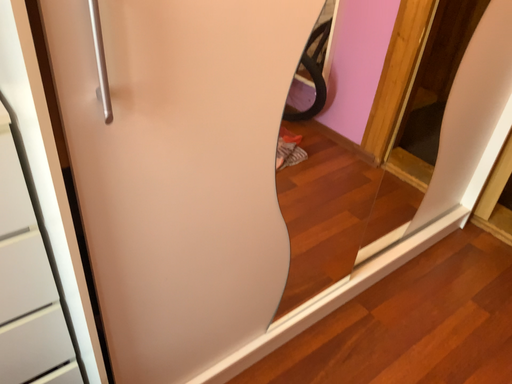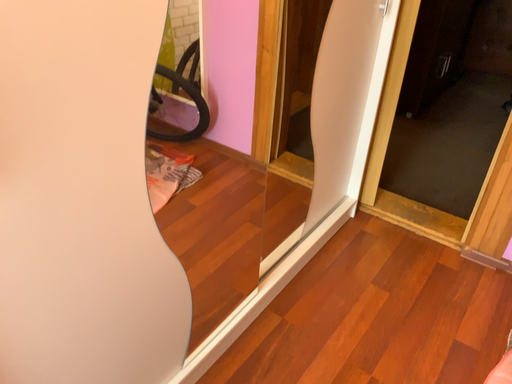
Question: Which way did the camera rotate in the video?

Choices:
 (A) rotated left
 (B) rotated right

Answer: (B)